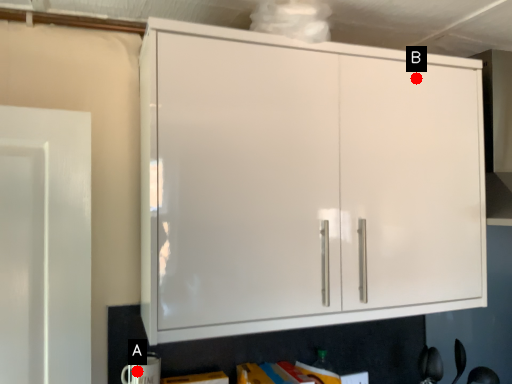
Question: Two points are circled on the image, labeled by A and B beside each circle. Which point is closer to the camera taking this photo?

Choices:
 (A) A is closer
 (B) B is closer

Answer: (A)